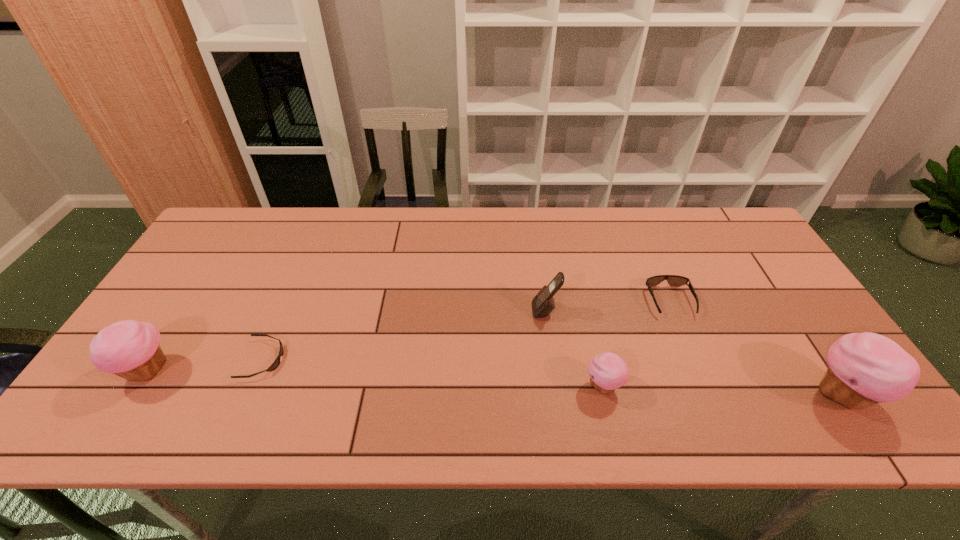
Where is `object present at the right edge`? The width and height of the screenshot is (960, 540). object present at the right edge is located at coordinates 864,369.

Identify the location of object that is at the near left corner. The height and width of the screenshot is (540, 960). (130, 349).

Locate an element on the screen. object situated at the near right corner is located at coordinates (864, 369).

This screenshot has width=960, height=540. I want to click on free spot at the far edge of the desktop, so click(x=660, y=226).

In order to click on vacant space at the near edge in this screenshot , I will do `click(478, 398)`.

Find the location of a particular element. The image size is (960, 540). vacant point at the left edge is located at coordinates (195, 312).

Image resolution: width=960 pixels, height=540 pixels. Find the location of `vacant region at the right edge of the desktop`. vacant region at the right edge of the desktop is located at coordinates (728, 264).

At what (x,y) coordinates should I click in order to perform the action: click on free space at the far left corner. Please return your answer as a coordinate pair (x, y). Looking at the image, I should click on (210, 252).

Where is `blank space at the far right corner`? The height and width of the screenshot is (540, 960). blank space at the far right corner is located at coordinates click(738, 226).

This screenshot has height=540, width=960. I want to click on free point between the leftmost cupcake and the nearer sunglasses, so click(205, 365).